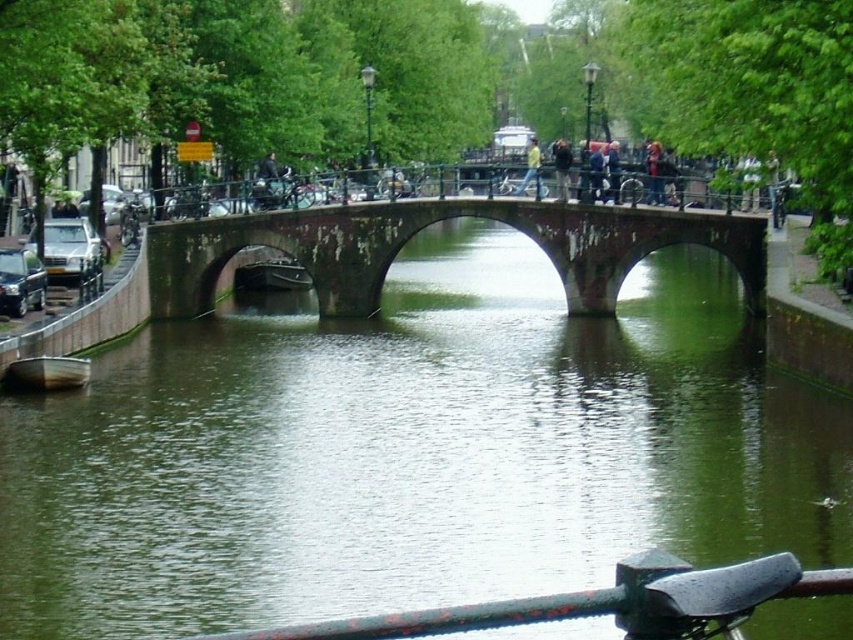
Question: Which object is the farthest from the rusty stone bridge at center?

Choices:
 (A) rusty metal rail at lower center
 (B) green water at center

Answer: (A)

Question: Among these objects, which one is nearest to the camera?

Choices:
 (A) rusty stone bridge at center
 (B) green water at center

Answer: (B)

Question: Is green water at center bigger than rusty metal rail at lower center?

Choices:
 (A) yes
 (B) no

Answer: (A)

Question: Is green water at center to the right of rusty metal rail at lower center from the viewer's perspective?

Choices:
 (A) yes
 (B) no

Answer: (A)

Question: In this image, where is rusty stone bridge at center located relative to rusty metal rail at lower center?

Choices:
 (A) right
 (B) left

Answer: (A)

Question: Which of these objects is positioned closest to the rusty stone bridge at center?

Choices:
 (A) green water at center
 (B) rusty metal rail at lower center

Answer: (A)